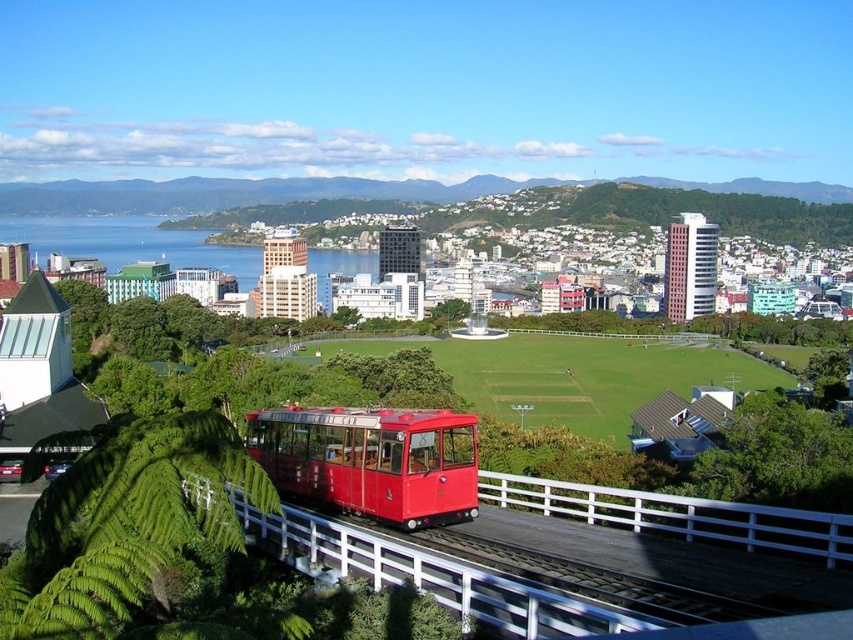
You are a city planner analyzing the image. The matte red tram at center and the blue water at center are both in the central area. Which one has a greater width according to the scene?

The blue water at center has a greater width than the matte red tram at center.

You are a tourist standing at the observation deck of the city. You see the matte red tram at center and the blue water at center. Which object is closer to the ground level?

The matte red tram at center is located below blue water at center, so the matte red tram at center is closer to the ground level.

You are a tourist standing at the observation deck and want to take a photo of the matte red tram at center and the blue water at center. Which object will appear larger in your photo?

The matte red tram at center will appear larger in the photo because it is closer to the viewer than the blue water at center.